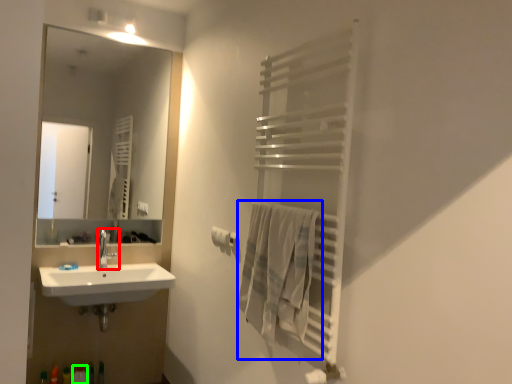
Question: Which is nearer to the tap (highlighted by a red box)? bath towel (highlighted by a blue box) or toiletry (highlighted by a green box).

Choices:
 (A) bath towel
 (B) toiletry

Answer: (B)